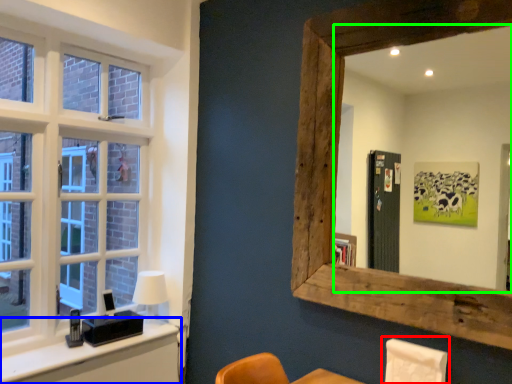
Question: Which is farther away from swivel chair (highlighted by a red box)? vanity (highlighted by a blue box) or mirror (highlighted by a green box)?

Choices:
 (A) vanity
 (B) mirror

Answer: (B)